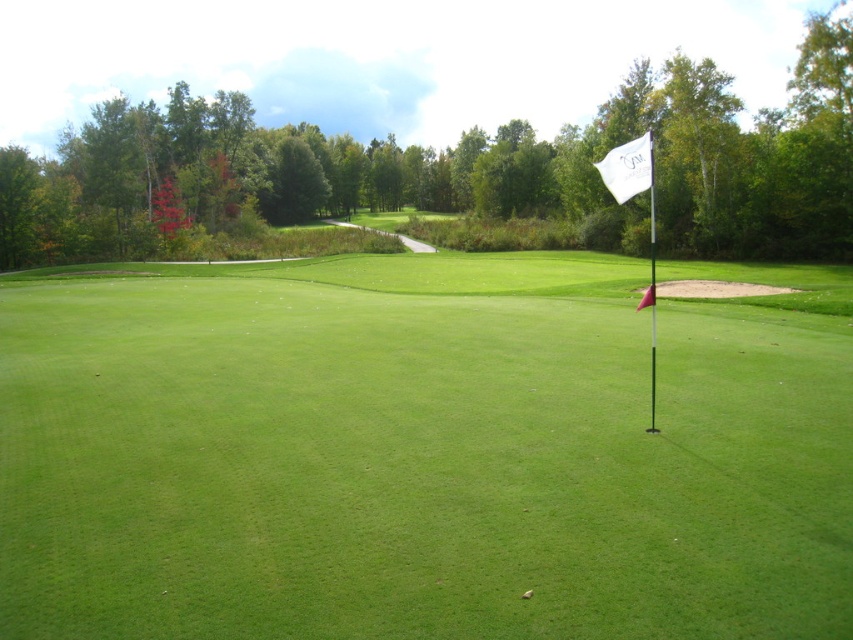
Which of these two, white flag at right or white fabric flag at upper right, stands taller?

Standing taller between the two is white fabric flag at upper right.

Is point (461, 260) in front of point (648, 145)?

No, it is behind (648, 145).

The height and width of the screenshot is (640, 853). In order to click on white flag at right in this screenshot , I will do `click(416, 456)`.